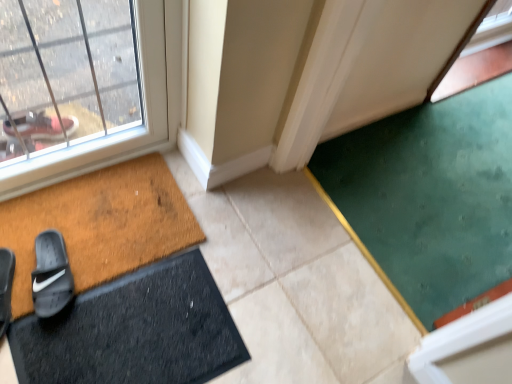
The height and width of the screenshot is (384, 512). Identify the location of vacant region above black rubber slide at lower left, positioned as the first footwear in right-to-left order (from a real-world perspective). (48, 268).